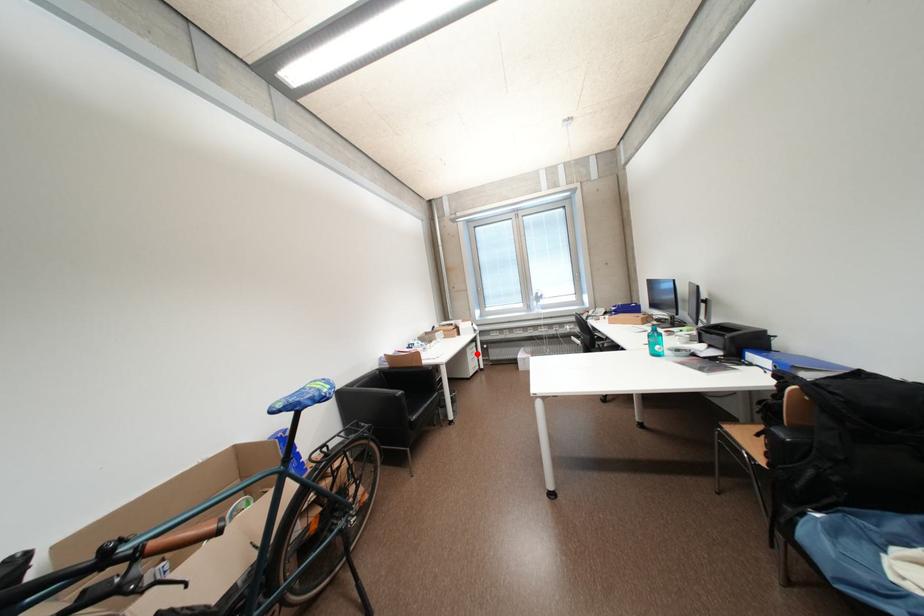
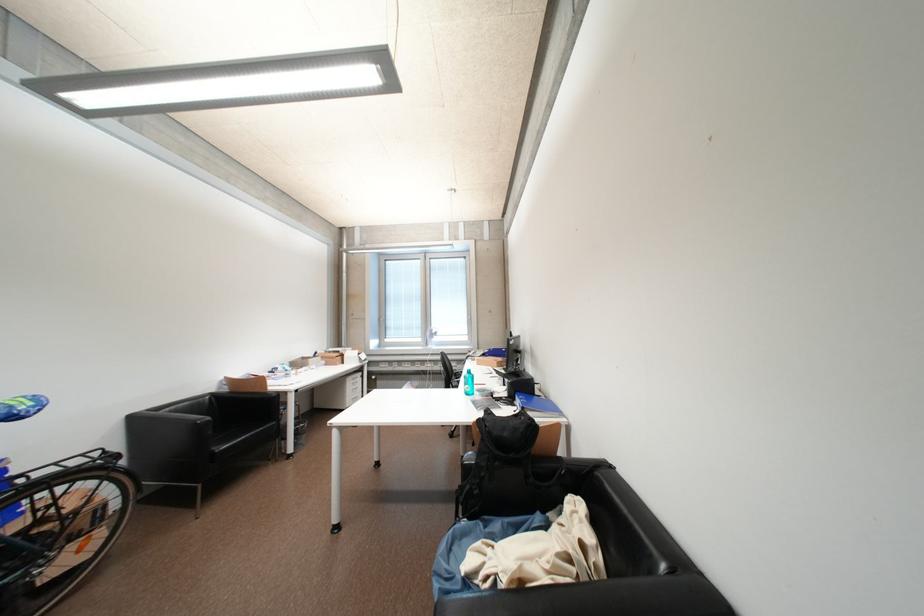
Question: I am providing you with two images of the same scene from different viewpoints. Given a red point in image1, look at the same physical point in image2. Is it:

Choices:
 (A) Closer to the viewpoint
 (B) Farther from the viewpoint

Answer: (B)